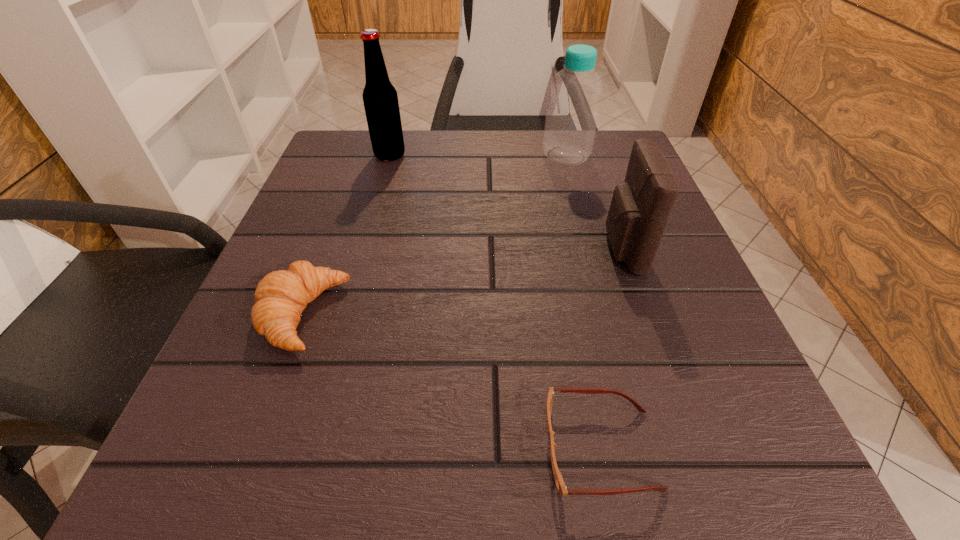
Where is `free point located with an open flap on the third shortest object`? This screenshot has height=540, width=960. free point located with an open flap on the third shortest object is located at coordinates click(x=488, y=249).

You are a GUI agent. You are given a task and a screenshot of the screen. Output one action in this format:
    pyautogui.click(x=<x>, y=<y>)
    Task: Click on the vacant space situated 0.060m on the back of the crescent roll
    
    Given the screenshot: What is the action you would take?
    pyautogui.click(x=325, y=253)

Locate an element on the screen. Image resolution: width=960 pixels, height=540 pixels. vacant area located 0.220m on the front-facing side of the nearest object is located at coordinates (354, 449).

At what (x,y) coordinates should I click in order to perform the action: click on vacant area situated 0.110m on the front-facing side of the nearest object. Please return your answer as a coordinate pair (x, y). Image resolution: width=960 pixels, height=540 pixels. Looking at the image, I should click on (450, 449).

The image size is (960, 540). In order to click on vacant space located on the front-facing side of the nearest object in this screenshot , I will do `click(301, 449)`.

You are a GUI agent. You are given a task and a screenshot of the screen. Output one action in this format:
    pyautogui.click(x=<x>, y=<y>)
    Task: Click on the beer bottle positioned at the far edge
    The width and height of the screenshot is (960, 540).
    Given the screenshot: What is the action you would take?
    pyautogui.click(x=380, y=98)

Where is `bottle situated at the far edge`? The height and width of the screenshot is (540, 960). bottle situated at the far edge is located at coordinates [x=571, y=121].

What are the coordinates of `object located in the near edge section of the desktop` in the screenshot? It's located at (560, 484).

Find the location of a particular element. This screenshot has height=540, width=960. beer bottle situated at the left edge is located at coordinates (380, 98).

The height and width of the screenshot is (540, 960). What are the coordinates of `crescent roll that is at the left edge` in the screenshot? It's located at (281, 296).